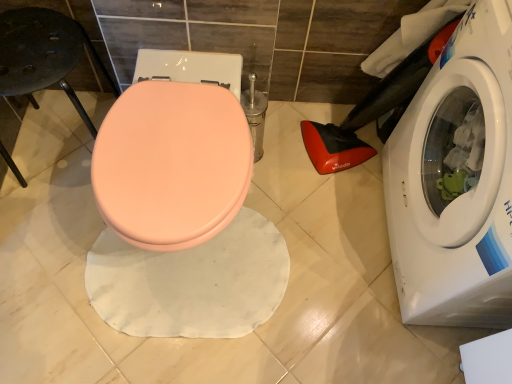
Question: Is matte peach toilet seat at center thinner than white glossy washing machine at lower right?

Choices:
 (A) no
 (B) yes

Answer: (A)

Question: Considering the relative sizes of matte peach toilet seat at center and white glossy washing machine at lower right in the image provided, is matte peach toilet seat at center bigger than white glossy washing machine at lower right?

Choices:
 (A) yes
 (B) no

Answer: (B)

Question: Is matte peach toilet seat at center positioned with its back to white glossy washing machine at lower right?

Choices:
 (A) yes
 (B) no

Answer: (B)

Question: Is matte peach toilet seat at center not close to white glossy washing machine at lower right?

Choices:
 (A) no
 (B) yes

Answer: (A)

Question: Can you confirm if matte peach toilet seat at center is taller than white glossy washing machine at lower right?

Choices:
 (A) yes
 (B) no

Answer: (B)

Question: From the image's perspective, is matte peach toilet seat at center under white glossy washing machine at lower right?

Choices:
 (A) no
 (B) yes

Answer: (B)

Question: Considering the relative sizes of white glossy washing machine at lower right and black matte bar stool at left in the image provided, is white glossy washing machine at lower right smaller than black matte bar stool at left?

Choices:
 (A) yes
 (B) no

Answer: (B)

Question: From the image's perspective, is white glossy washing machine at lower right beneath black matte bar stool at left?

Choices:
 (A) yes
 (B) no

Answer: (A)

Question: Does white glossy washing machine at lower right have a greater width compared to black matte bar stool at left?

Choices:
 (A) no
 (B) yes

Answer: (B)

Question: Is white glossy washing machine at lower right far from black matte bar stool at left?

Choices:
 (A) no
 (B) yes

Answer: (B)

Question: Is black matte bar stool at left inside white glossy washing machine at lower right?

Choices:
 (A) yes
 (B) no

Answer: (B)

Question: From a real-world perspective, does white glossy washing machine at lower right stand above black matte bar stool at left?

Choices:
 (A) yes
 (B) no

Answer: (A)

Question: Is black matte bar stool at left bigger than matte peach toilet seat at center?

Choices:
 (A) yes
 (B) no

Answer: (B)